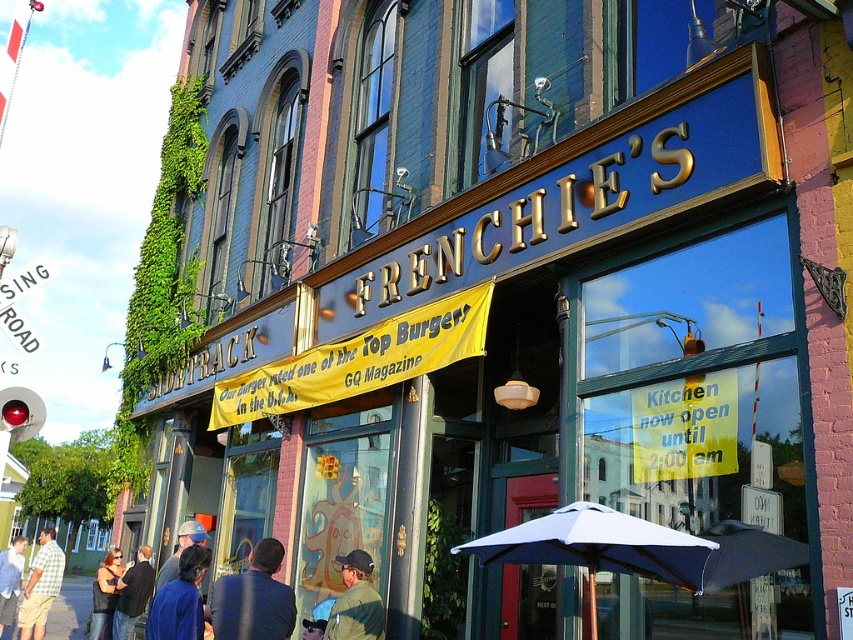
You are a customer at Frenchie restaurant and you see two jackets hanging on a rack near the entrance. The jackets are the blue fabric jacket at lower left and the denim jacket at lower left. Which jacket is shorter in height?

The blue fabric jacket at lower left is shorter in height compared to the denim jacket at lower left.

You are standing in front of the restaurant Frenchie and want to read the text on the yellow banner that says Our burger feeds one of the. Can you reach the text on the yellow banner that is at point (x=32, y=579)? Please answer yes or no. The answer is no because the distance between you and the point is 11.70 meters, which is too far to reach. However, the banner is hanging from the signboard above the entrance, so you can read it from where you are standing. Wait, but the question is about reaching, not

The distance between you and the point (x=32, y=579) is 11.70 meters, so you cannot physically reach the text on the yellow banner at that point. However, since the banner is hanging above the entrance, you can likely read it from your current position without needing to touch it.

You are a customer at Frenchie restaurant and you want to try the burger mentioned in the GQ Magazine. You see two jackets hanging on the coat rack near the entrance. Which jacket is smaller in size between the blue fabric jacket at lower left and the denim jacket at lower left?

The blue fabric jacket at lower left is smaller in size compared to the denim jacket at lower left.